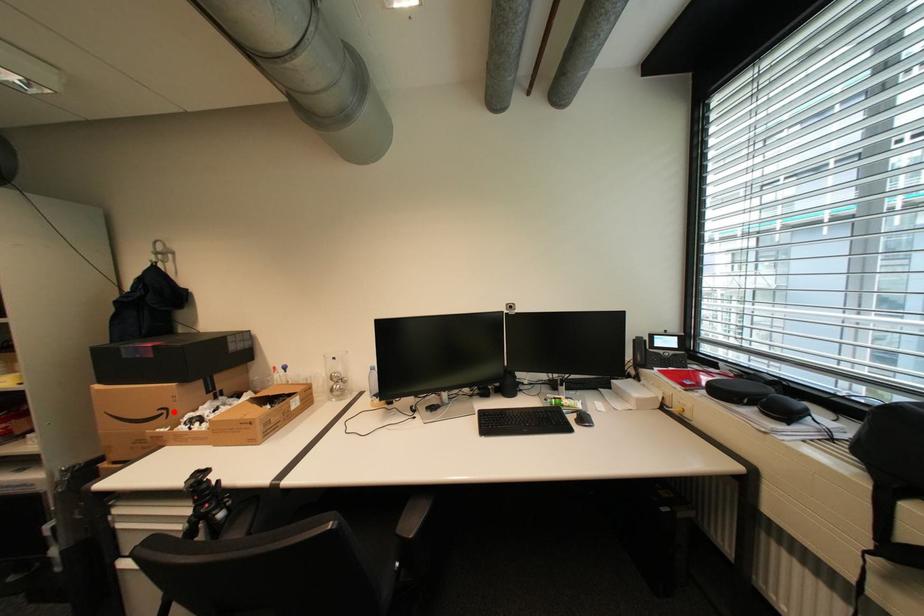
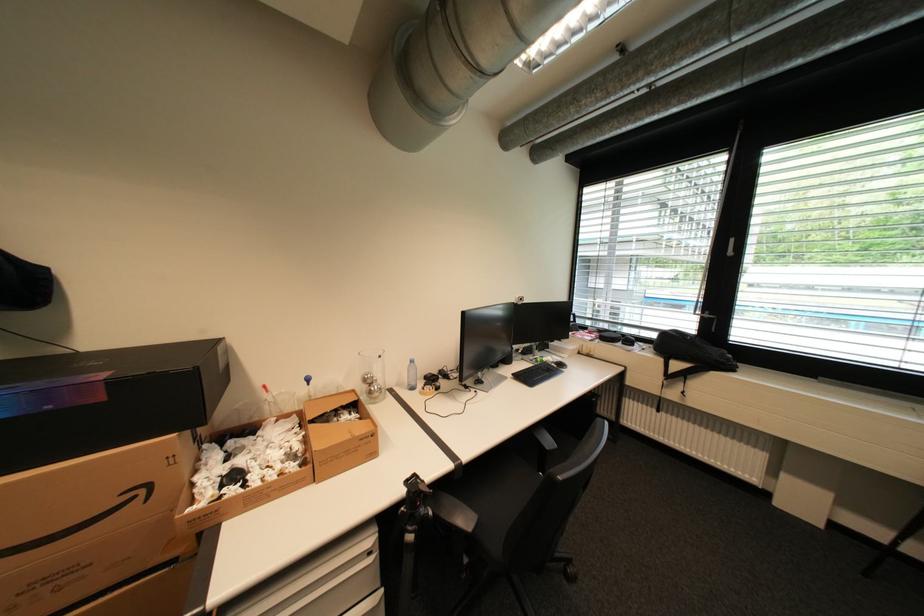
Where in the second image is the point corresponding to the highlighted location from the first image?

(151, 491)